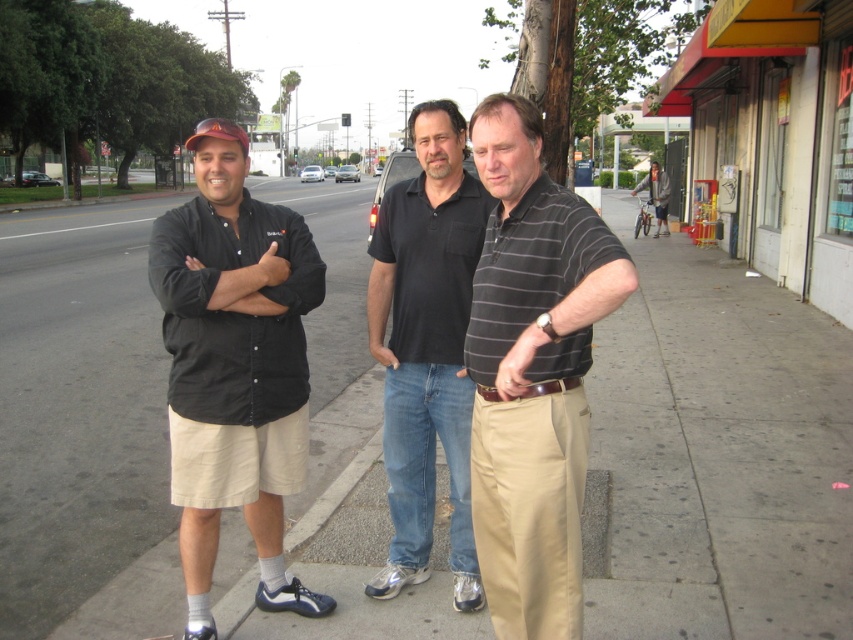
Is point (183, 536) positioned before point (654, 196)?

That is True.

Find the location of a particular element. black cotton shirt at left is located at coordinates pos(234,365).

Where is `black cotton shirt at left`? This screenshot has width=853, height=640. black cotton shirt at left is located at coordinates (234, 365).

Who is more forward, (x=503, y=371) or (x=378, y=273)?

Point (x=503, y=371) is more forward.

Who is shorter, black striped shirt at center or black smooth shirt at center?

black striped shirt at center

I want to click on black striped shirt at center, so click(595, 296).

This screenshot has width=853, height=640. Find the location of `black striped shirt at center`. black striped shirt at center is located at coordinates [595, 296].

Which of these two, khaki pants at center or black matte shirt at center, stands taller?

khaki pants at center is taller.

Is khaki pants at center smaller than black matte shirt at center?

No.

Between point (479, 276) and point (170, 216), which one is positioned behind?

Point (170, 216)

At what (x,y) coordinates should I click in order to perform the action: click on khaki pants at center. Please return your answer as a coordinate pair (x, y). This screenshot has width=853, height=640. Looking at the image, I should click on (532, 372).